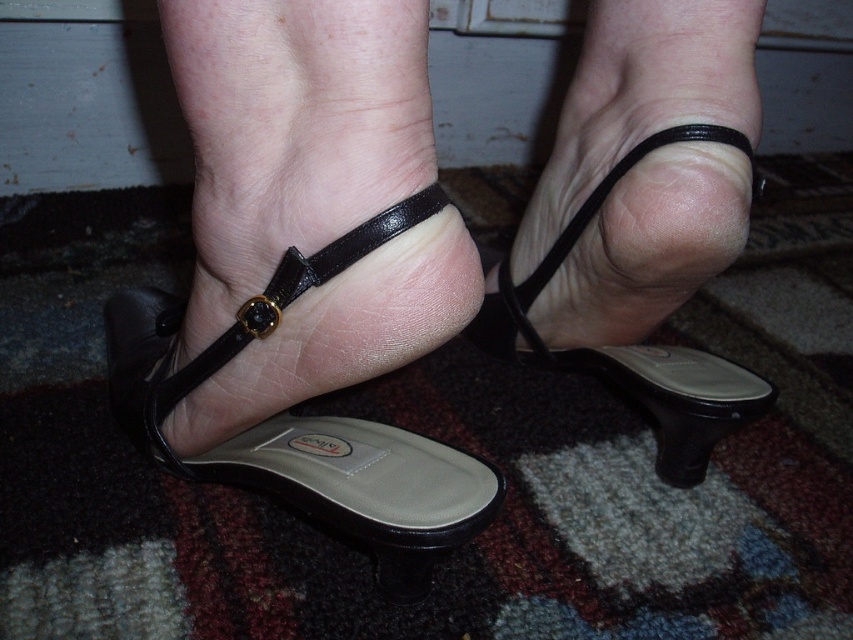
Is point (419, 536) positioned behind point (521, 301)?

No.

Does point (283, 467) lie behind point (695, 378)?

No.

At what (x,y) coordinates should I click in order to perform the action: click on black leather sandal at lower left. Please return your answer as a coordinate pair (x, y). Looking at the image, I should click on (311, 458).

Which is behind, point (647, 369) or point (271, 285)?

The point (647, 369) is more distant.

Does black leather sandal at center come behind black leather strap at center?

Yes, it is behind black leather strap at center.

I want to click on black leather sandal at center, so click(634, 344).

Where is `black leather sandal at center`? The image size is (853, 640). black leather sandal at center is located at coordinates (634, 344).

Does black leather sandal at lower left appear under black leather strap at center?

Indeed, black leather sandal at lower left is positioned under black leather strap at center.

Can you confirm if black leather sandal at lower left is wider than black leather strap at center?

Indeed, black leather sandal at lower left has a greater width compared to black leather strap at center.

Is point (138, 364) farther from viewer compared to point (347, 232)?

Yes, it is behind point (347, 232).

This screenshot has width=853, height=640. I want to click on black leather sandal at lower left, so click(311, 458).